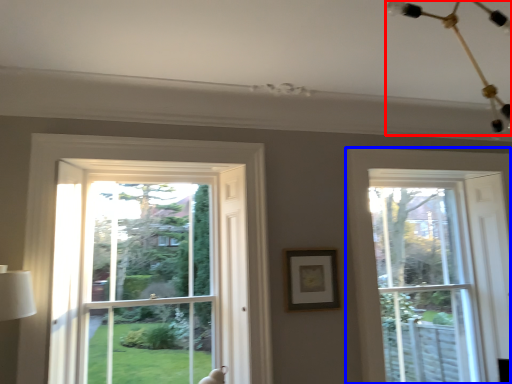
Question: Which object is further to the camera taking this photo, light fixture (highlighted by a red box) or window (highlighted by a blue box)?

Choices:
 (A) light fixture
 (B) window

Answer: (B)